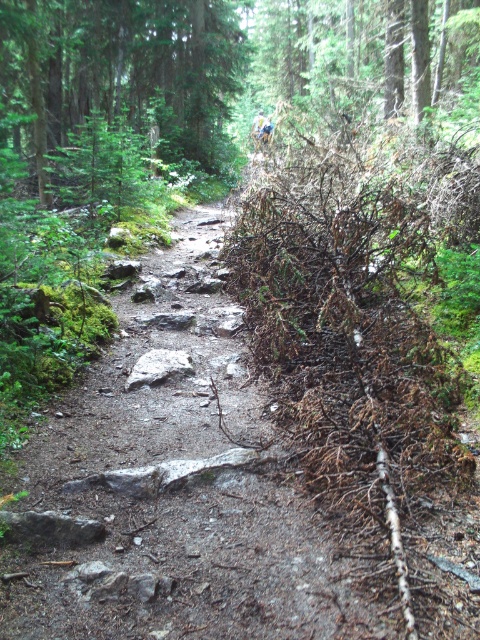
You are a hiker standing on the dirt path at center and want to reach the green matte tree at upper center. Which direction should you move to get closer to the tree?

You should move forward along the dirt path at center because it is closer to you than the green matte tree at upper center, so moving forward will bring you nearer to the tree.

You are a hiker with a 30 feet long rope. You want to tie the rope between the dirt path at center and the green matte tree at upper center to mark the trail. Is the rope long enough to reach both points?

The distance between the dirt path at center and the green matte tree at upper center is 27.39 feet. Since the rope is 30 feet long, it is long enough to reach both points.